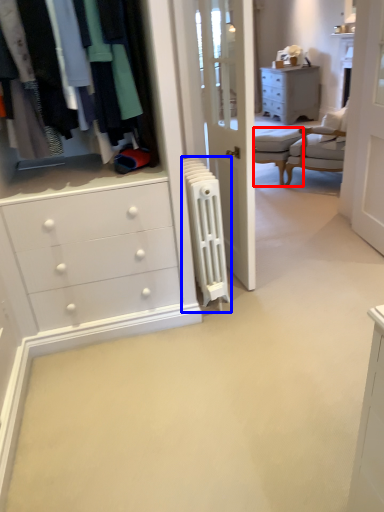
Question: Among these objects, which one is farthest to the camera, armchair (highlighted by a red box) or radiator (highlighted by a blue box)?

Choices:
 (A) armchair
 (B) radiator

Answer: (A)